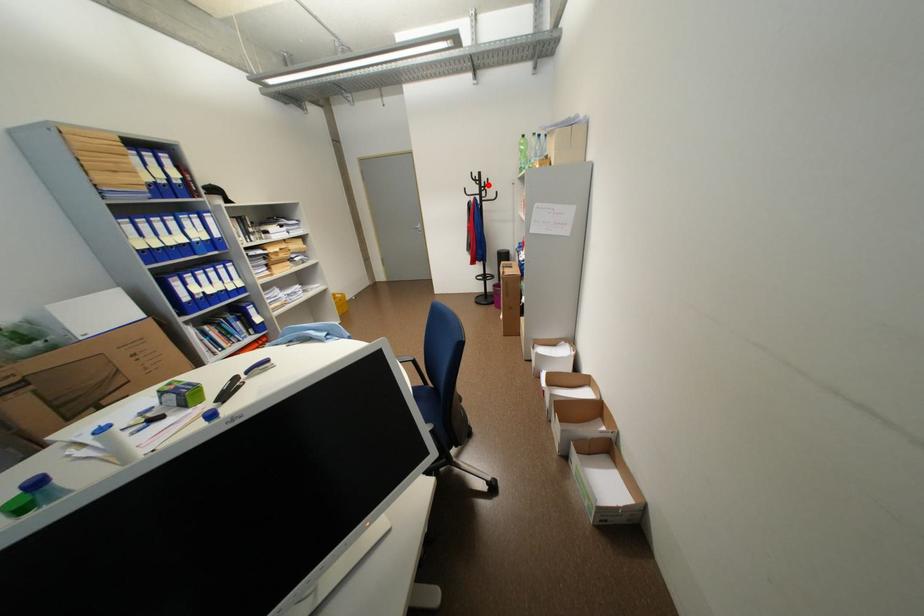
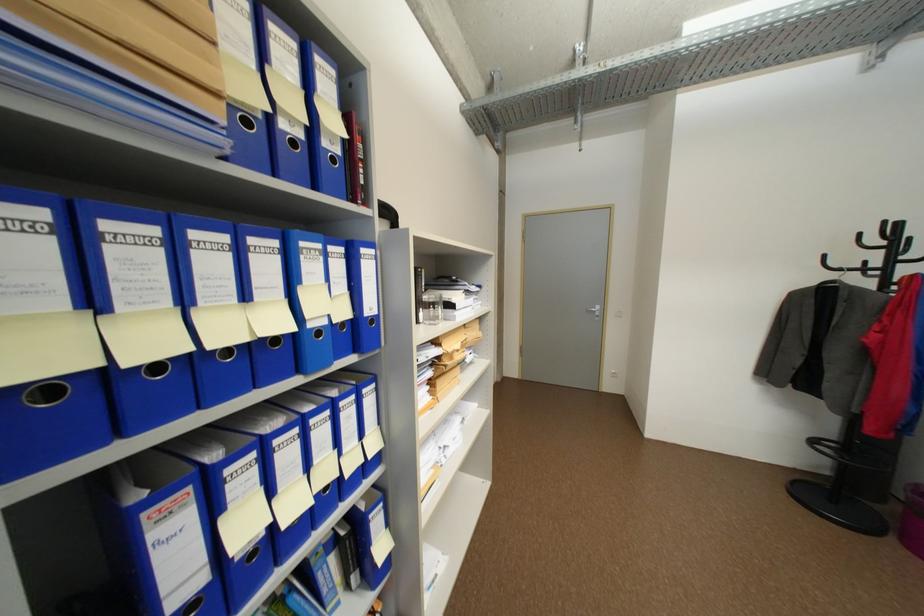
Question: I am providing you with two images of the same scene from different viewpoints. Given a red point in image1, look at the same physical point in image2. Is it:

Choices:
 (A) Closer to the viewpoint
 (B) Farther from the viewpoint

Answer: (B)